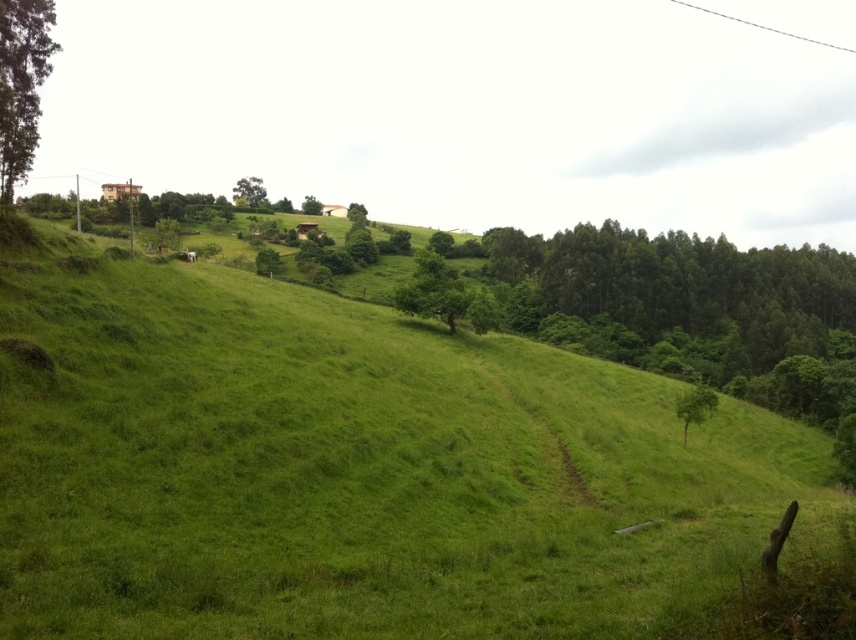
Question: Can you confirm if green leafy tree at right is positioned to the left of green leafy tree at upper center?

Choices:
 (A) no
 (B) yes

Answer: (A)

Question: Is green leafy tree at right above green leafy tree at center?

Choices:
 (A) yes
 (B) no

Answer: (B)

Question: Which of these objects is positioned farthest from the green leafy tree at upper center?

Choices:
 (A) green leafy tree at left
 (B) green leafy tree at center
 (C) green leafy tree at right

Answer: (C)

Question: Which is nearer to the green grassy hillside at center?

Choices:
 (A) green leafy tree at center
 (B) green leafy tree at upper center

Answer: (B)

Question: Is green grassy hillside at center above green leafy tree at upper center?

Choices:
 (A) no
 (B) yes

Answer: (A)

Question: Which point is closer to the camera?

Choices:
 (A) green leafy tree at left
 (B) green leafy tree at right

Answer: (A)